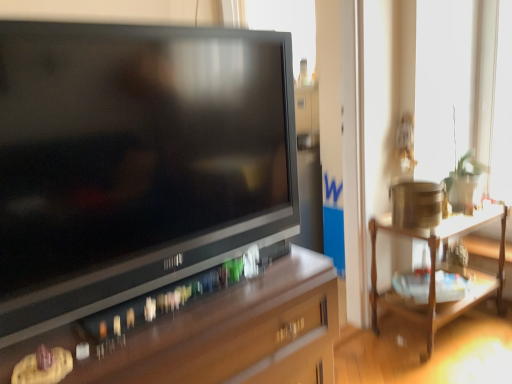
At what (x,y) coordinates should I click in order to perform the action: click on vacant area that is in front of wooden table at right. Please return your answer as a coordinate pair (x, y). This screenshot has width=512, height=384. Looking at the image, I should click on (468, 359).